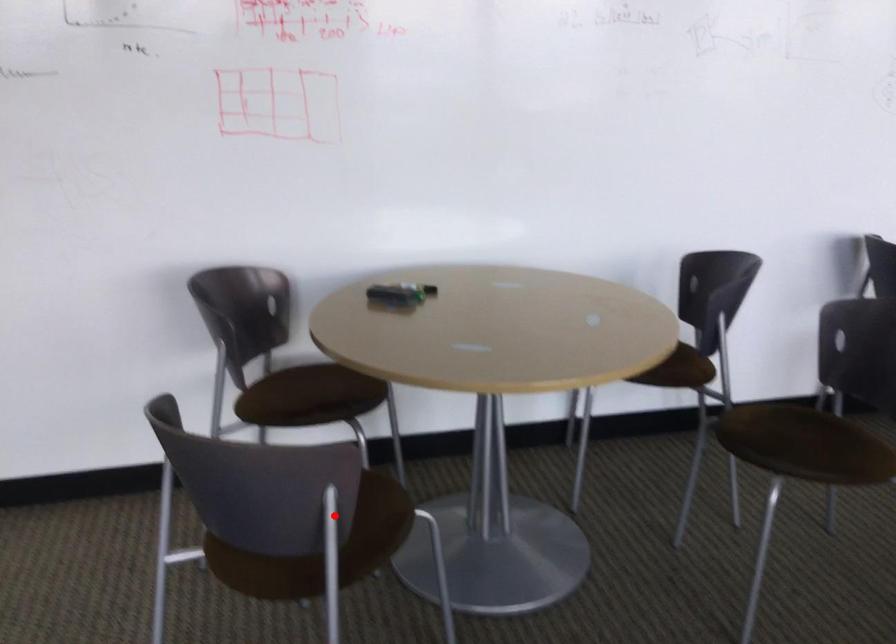
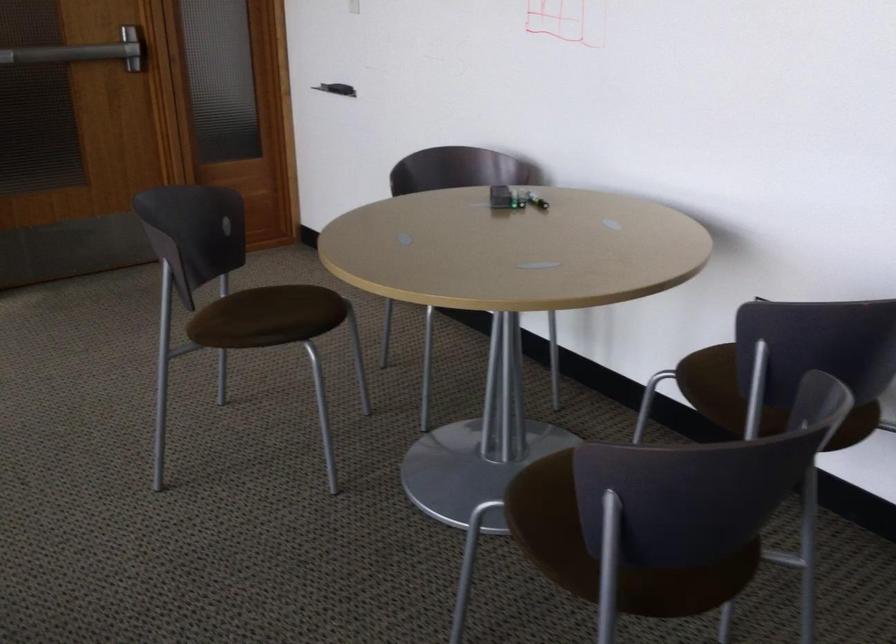
Question: A red point is marked in image1. In image2, is the corresponding 3D point closer to the camera or farther? Reply with the corresponding letter.

Choices:
 (A) The corresponding 3D point is closer.
 (B) The corresponding 3D point is farther.

Answer: (B)